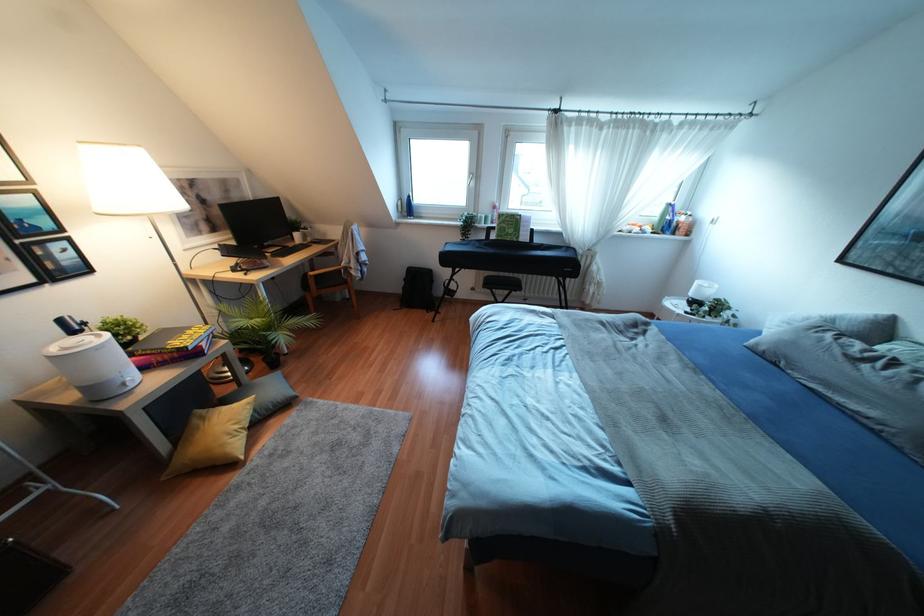
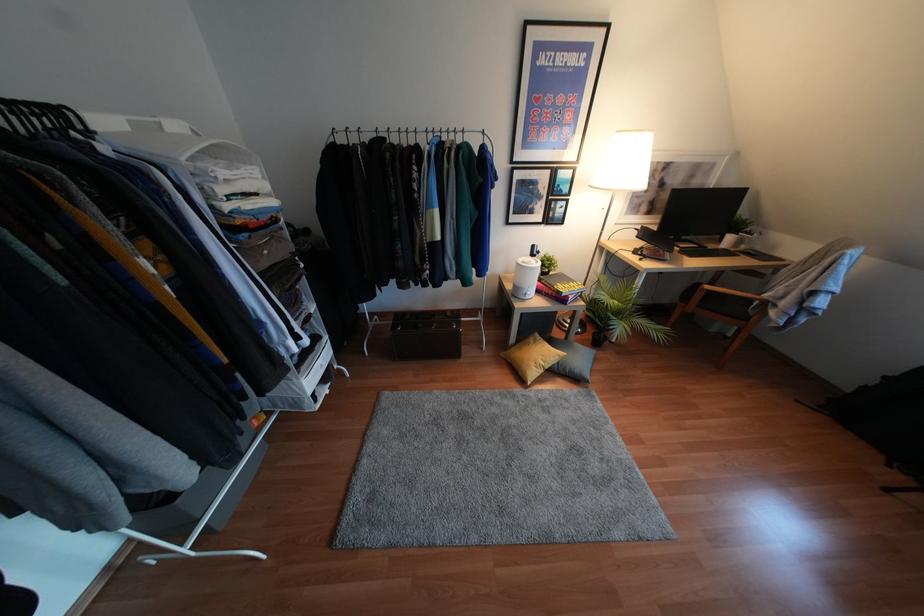
Find the pixel in the second image that matches [236,426] in the first image.

(541, 363)